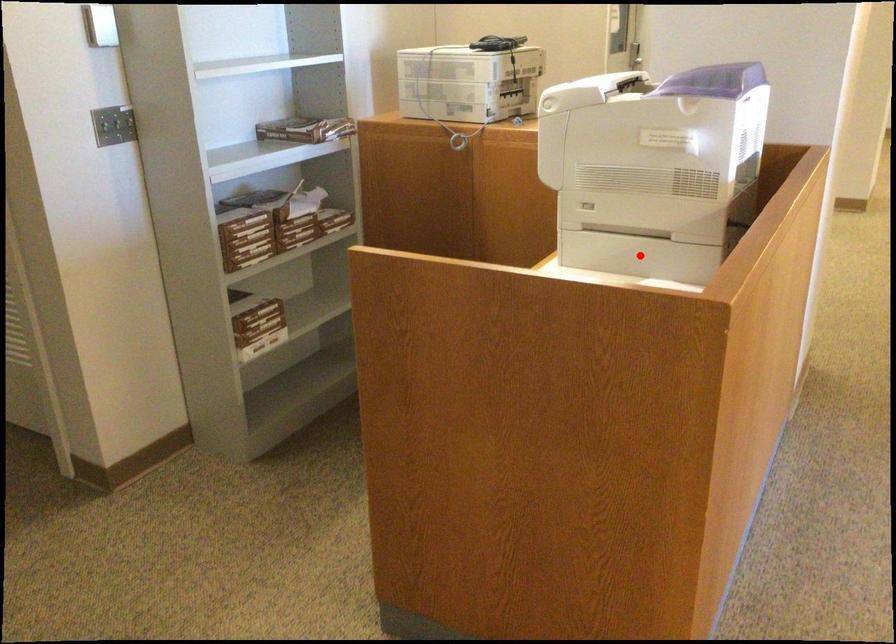
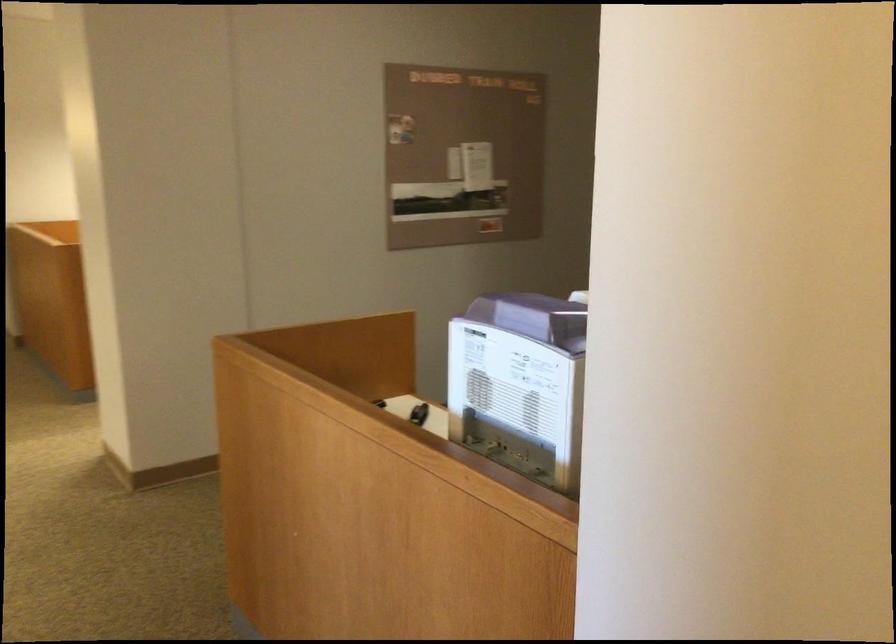
Question: I am providing you with two images of the same scene from different viewpoints. A red point is marked on the first image. Can you still see the location of the red point in image 2?

Choices:
 (A) Yes
 (B) No

Answer: (B)